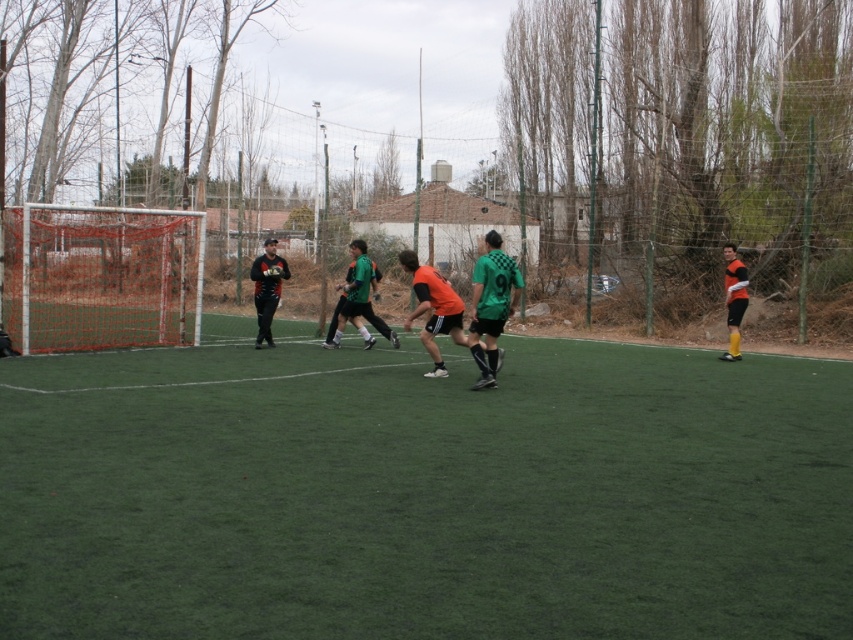
Question: Among these points, which one is nearest to the camera?

Choices:
 (A) (431, 308)
 (B) (494, 374)
 (C) (97, 220)
 (D) (724, 289)

Answer: (B)

Question: Does green matte jersey at center have a smaller size compared to orange matte jersey at right?

Choices:
 (A) no
 (B) yes

Answer: (A)

Question: Does matte black jacket at center appear under orange matte jersey at right?

Choices:
 (A) no
 (B) yes

Answer: (A)

Question: Considering the real-world distances, which object is closest to the green matte jersey at center?

Choices:
 (A) green artificial turf at center
 (B) orange matte jersey at right
 (C) matte black jacket at center
 (D) orange mesh net at left

Answer: (A)

Question: Which point appears farthest from the camera in this image?

Choices:
 (A) (743, 275)
 (B) (260, 300)

Answer: (B)

Question: Is green matte jersey at center bigger than matte black jacket at center?

Choices:
 (A) no
 (B) yes

Answer: (A)